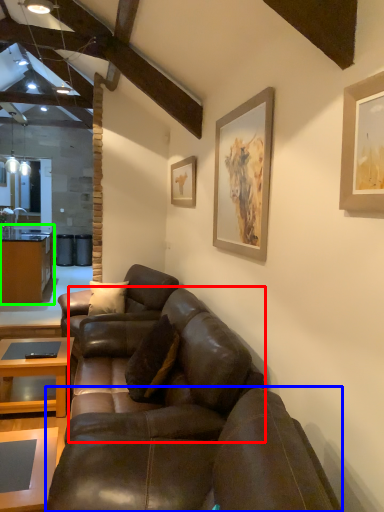
Question: Which object is positioned farthest from studio couch (highlighted by a red box)? Select from studio couch (highlighted by a blue box) and cabinetry (highlighted by a green box).

Choices:
 (A) studio couch
 (B) cabinetry

Answer: (B)